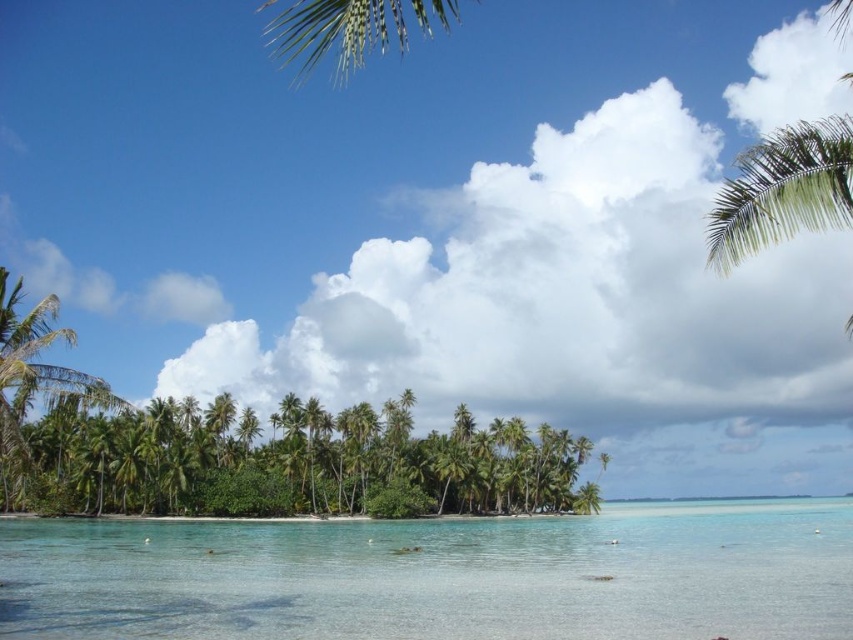
Question: From the image, what is the correct spatial relationship of clear water at center in relation to green leafy palm tree at upper right?

Choices:
 (A) below
 (B) above

Answer: (A)

Question: Among these points, which one is farthest from the camera?

Choices:
 (A) (737, 189)
 (B) (810, 579)

Answer: (B)

Question: Is clear water at center bigger than green leafy palm tree at upper right?

Choices:
 (A) yes
 (B) no

Answer: (B)

Question: Does clear water at center have a smaller size compared to green leafy palm tree at upper right?

Choices:
 (A) yes
 (B) no

Answer: (A)

Question: Which point is farther from the camera taking this photo?

Choices:
 (A) (759, 186)
 (B) (625, 579)

Answer: (B)